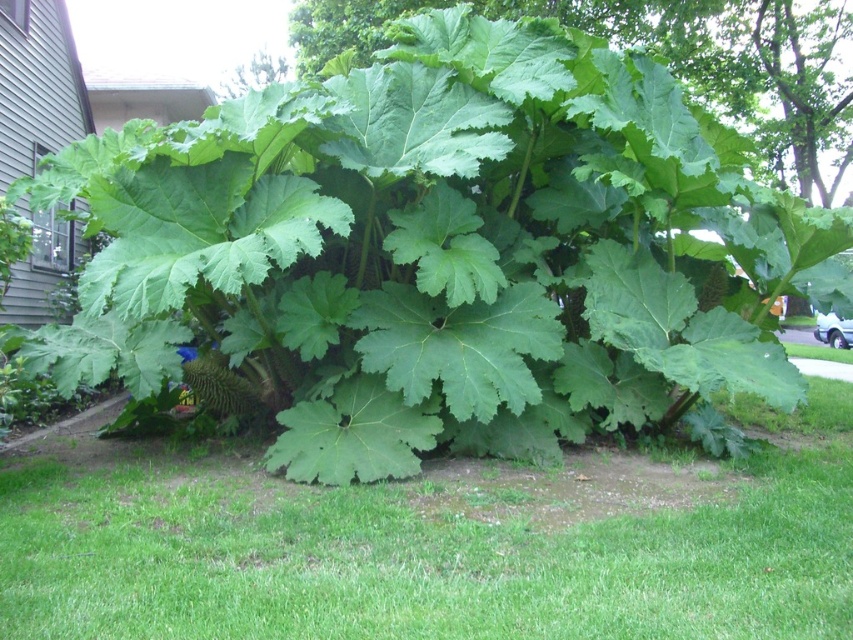
Does green grass at center come behind green leafy plant at center?

No, it is not.

Image resolution: width=853 pixels, height=640 pixels. What do you see at coordinates (425, 552) in the screenshot?
I see `green grass at center` at bounding box center [425, 552].

Locate an element on the screen. The image size is (853, 640). green grass at center is located at coordinates (425, 552).